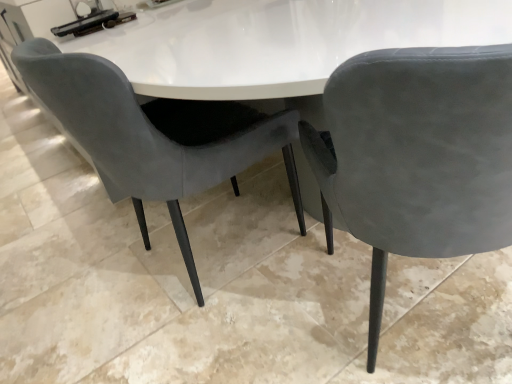
Image resolution: width=512 pixels, height=384 pixels. I want to click on free space underneath suede gray chair at center, which is the 2th chair from right to left (from a real-world perspective), so click(x=212, y=253).